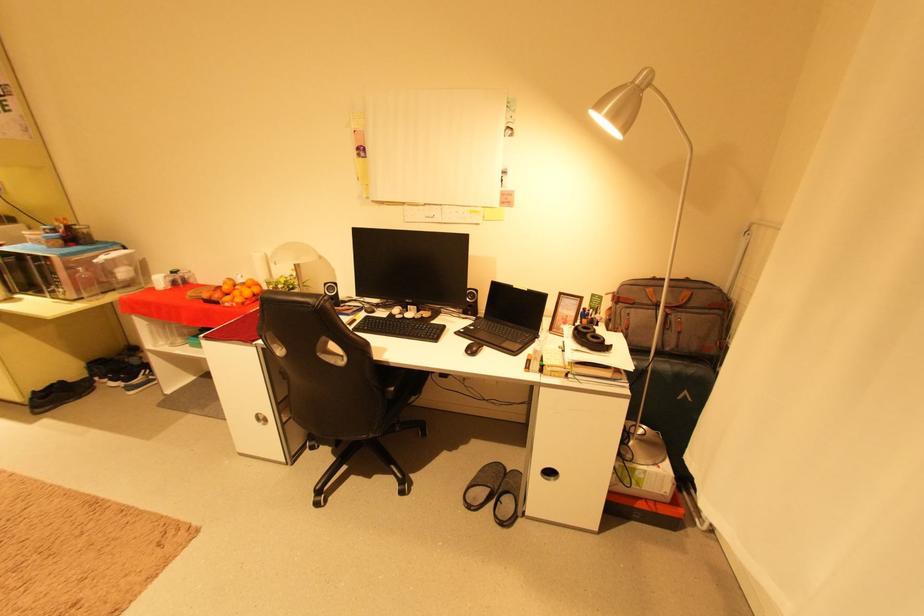
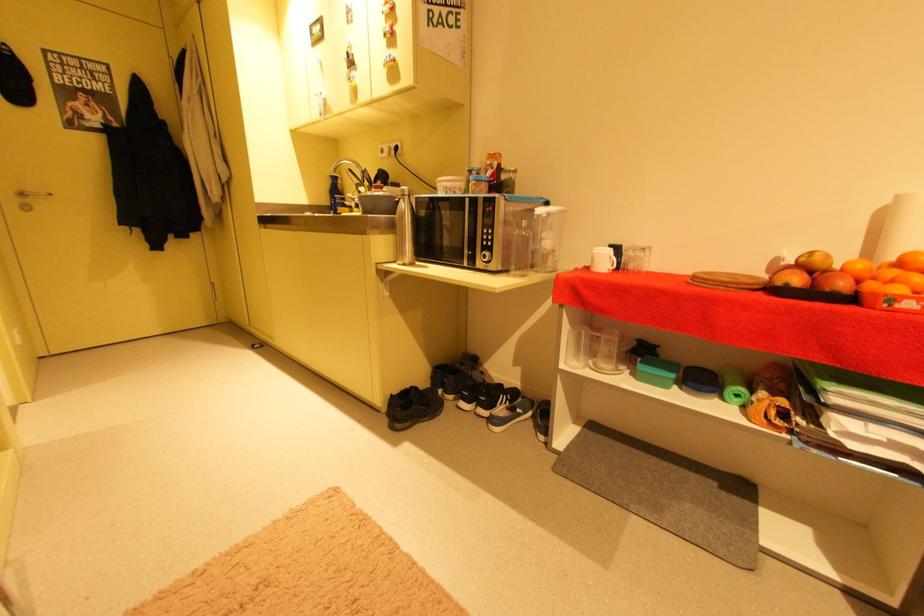
The images are taken continuously from a first-person perspective. In which direction are you moving?

The movement direction of the cameraman is left, forward.